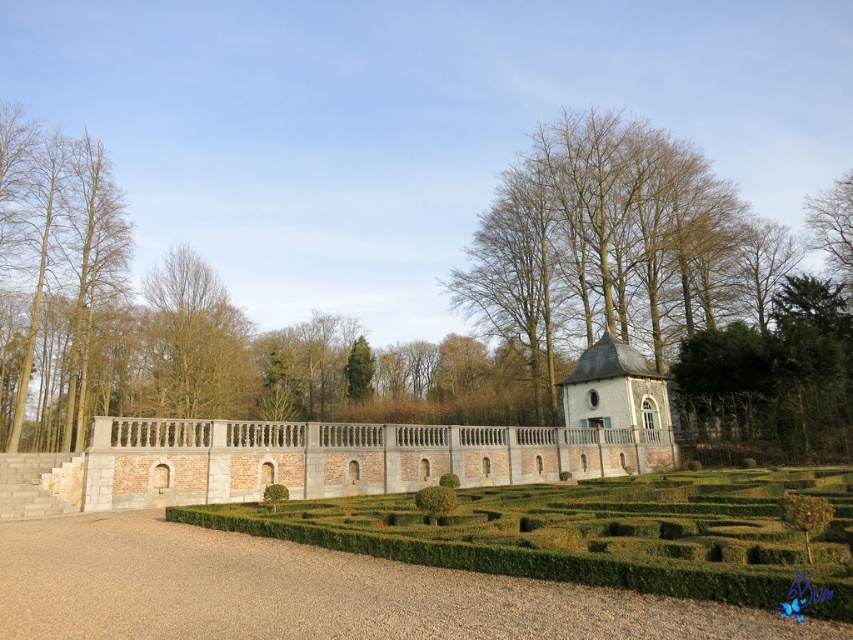
Question: Which of the following is the farthest from the observer?

Choices:
 (A) (825, 548)
 (B) (196, 273)
 (C) (363, 337)
 (D) (648, 372)

Answer: (C)

Question: Is green hedge maze at center to the right of green leafy tree at center from the viewer's perspective?

Choices:
 (A) no
 (B) yes

Answer: (B)

Question: Is green hedge maze at center below white brick gazebo at center-right?

Choices:
 (A) no
 (B) yes

Answer: (B)

Question: Which of these objects is positioned farthest from the white brick gazebo at center-right?

Choices:
 (A) green hedge maze at center
 (B) green leafy tree at center
 (C) green textured tree at center

Answer: (C)

Question: Which point is farther from the camera taking this photo?

Choices:
 (A) (590, 381)
 (B) (163, 260)
 (C) (372, 358)
 (D) (759, 499)

Answer: (C)

Question: Is white brick gazebo at center-right closer to the viewer compared to green textured tree at center?

Choices:
 (A) no
 (B) yes

Answer: (B)